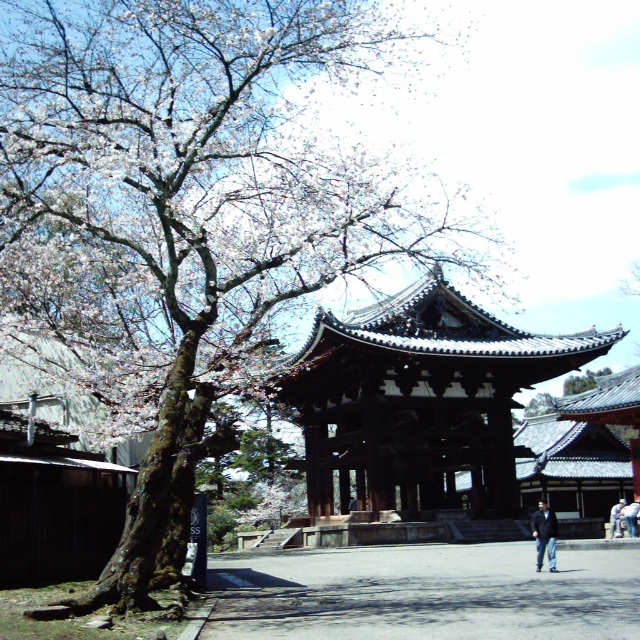
You are standing in front of the traditional Japanese gate and want to place a small statue exactly halfway between the two points marked as point (410,413) and point (632,522). Which direction should you move from the closer point to reach the halfway point?

Since point (410,413) is closer to the viewer than point (632,522), you should move towards the direction of the farther point (632,522) to reach the halfway point between them.